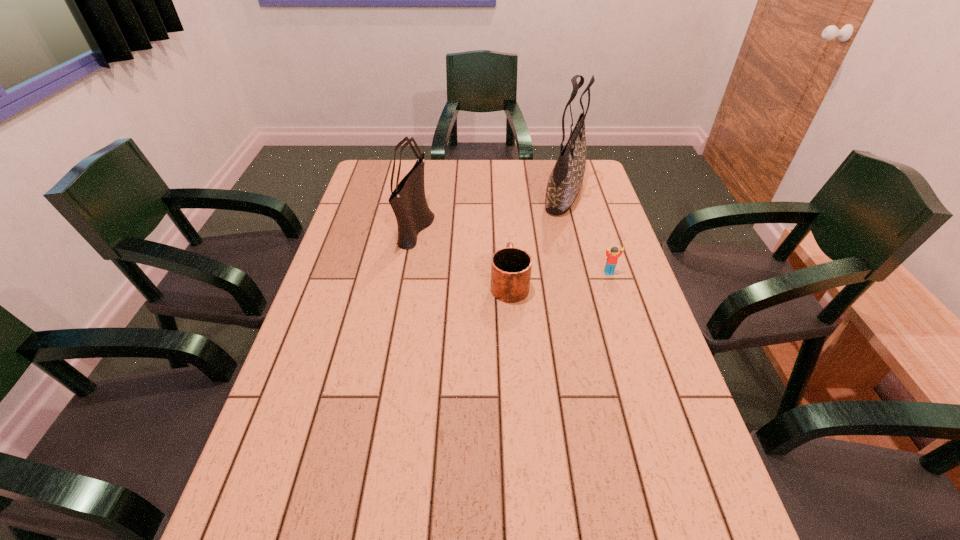
I want to click on the tallest object, so click(564, 184).

The height and width of the screenshot is (540, 960). I want to click on shoulder bag, so click(408, 201).

Image resolution: width=960 pixels, height=540 pixels. What are the coordinates of `the leftmost object` in the screenshot? It's located at (408, 201).

Locate an element on the screen. The width and height of the screenshot is (960, 540). the second object from left to right is located at coordinates (511, 267).

The height and width of the screenshot is (540, 960). I want to click on Lego, so click(x=612, y=257).

Locate an element on the screen. Image resolution: width=960 pixels, height=540 pixels. free space located 0.080m on the left of the tote bag is located at coordinates (518, 192).

Where is `vacant space situated 0.080m on the back of the second tallest object`? vacant space situated 0.080m on the back of the second tallest object is located at coordinates (423, 191).

Identify the location of vacant space located on the side of the second object from left to right with the handle. Image resolution: width=960 pixels, height=540 pixels. (506, 227).

Identify the location of free region located 0.140m on the side of the second object from left to right with the handle. (506, 234).

You are a GUI agent. You are given a task and a screenshot of the screen. Output one action in this format:
    pyautogui.click(x=<x>, y=<y>)
    Task: Click on the free spot located 0.390m on the side of the second object from left to right with the handle
    
    Given the screenshot: What is the action you would take?
    pyautogui.click(x=503, y=192)